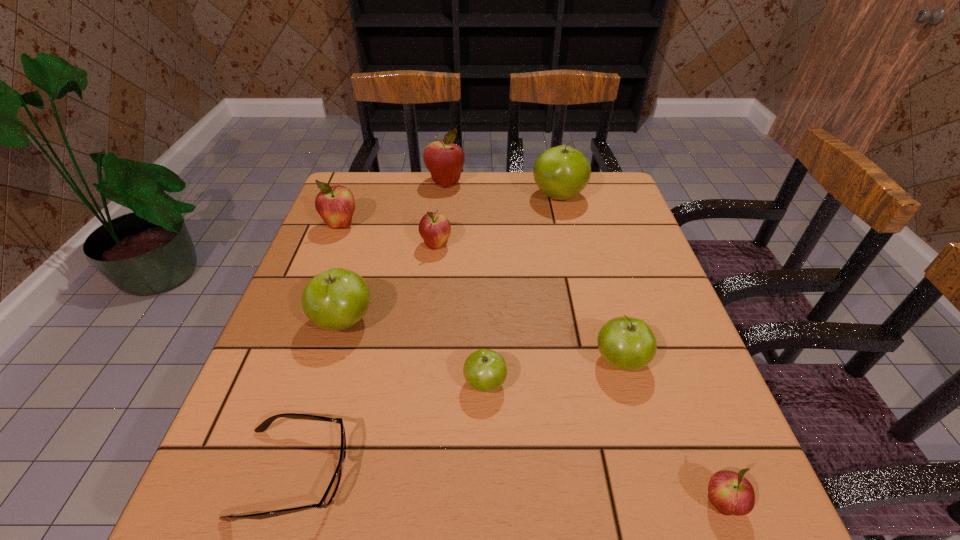
Find the location of a particular element. This screenshot has height=540, width=960. vacant space at the right edge of the desktop is located at coordinates (655, 375).

In the image, there is a desktop. Find the location of `vacant space at the far right corner`. vacant space at the far right corner is located at coordinates (602, 190).

This screenshot has width=960, height=540. What are the coordinates of `vacant region at the near right corner of the desktop` in the screenshot? It's located at (715, 516).

The image size is (960, 540). Identify the location of vacant region between the second biggest red apple and the shortest object. (317, 349).

This screenshot has width=960, height=540. I want to click on empty location between the leftmost red apple and the fourth apple from right to left, so click(413, 304).

Locate an element on the screen. The width and height of the screenshot is (960, 540). free space between the second biggest red apple and the shortest object is located at coordinates (317, 349).

You are a GUI agent. You are given a task and a screenshot of the screen. Output one action in this format:
    pyautogui.click(x=<x>, y=<y>)
    Task: Click on the free space between the third biggest red apple and the farthest green apple
    This screenshot has width=960, height=540.
    Given the screenshot: What is the action you would take?
    pyautogui.click(x=497, y=221)

Where is `empty space that is in between the farthest red apple and the second smallest red apple`? The height and width of the screenshot is (540, 960). empty space that is in between the farthest red apple and the second smallest red apple is located at coordinates (441, 213).

This screenshot has width=960, height=540. In order to click on free space between the second smallest green apple and the spectacles in this screenshot , I will do `click(457, 417)`.

Identify the location of free spot between the biggest red apple and the second smallest green apple. The height and width of the screenshot is (540, 960). (533, 272).